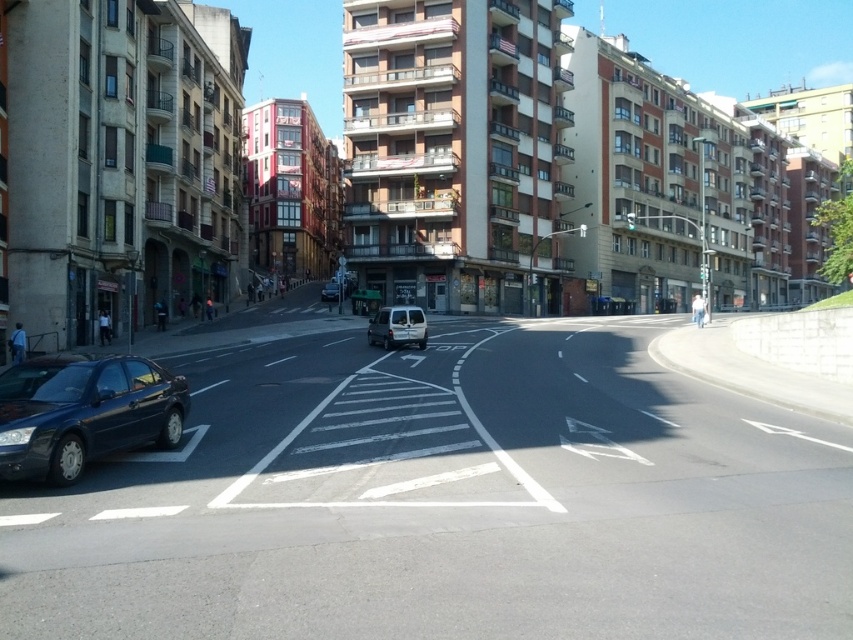
Question: Is matte black car at lower left to the right of matte silver van at center from the viewer's perspective?

Choices:
 (A) yes
 (B) no

Answer: (A)

Question: Which of these objects is positioned closest to the satin silver van at center?

Choices:
 (A) matte black car at lower left
 (B) matte silver van at center

Answer: (B)

Question: Estimate the real-world distances between objects in this image. Which object is closer to the satin silver van at center?

Choices:
 (A) matte black car at lower left
 (B) matte silver van at center

Answer: (B)

Question: Can you confirm if satin silver van at center is positioned to the right of matte silver van at center?

Choices:
 (A) no
 (B) yes

Answer: (B)

Question: Estimate the real-world distances between objects in this image. Which object is closer to the matte silver van at center?

Choices:
 (A) satin silver van at center
 (B) matte black car at lower left

Answer: (A)

Question: Does matte black car at lower left appear on the right side of matte silver van at center?

Choices:
 (A) no
 (B) yes

Answer: (B)